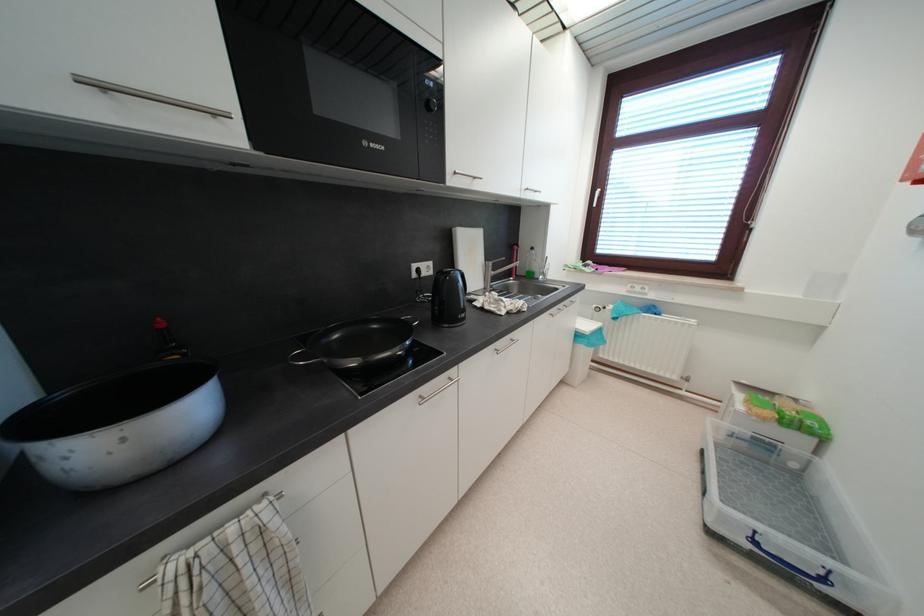
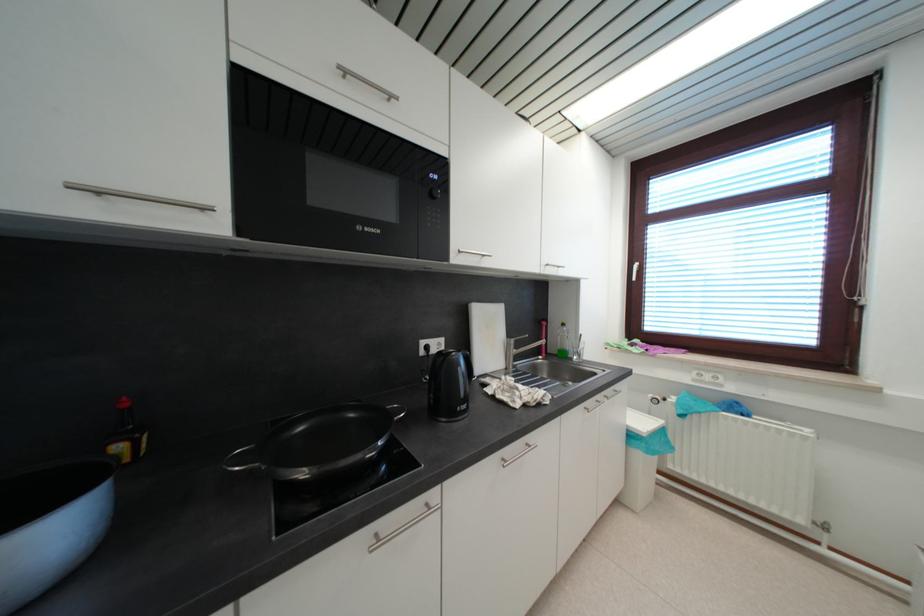
Question: The images are taken continuously from a first-person perspective. In which direction is your viewpoint rotating?

Choices:
 (A) Left
 (B) Right
 (C) Up
 (D) Down

Answer: (C)